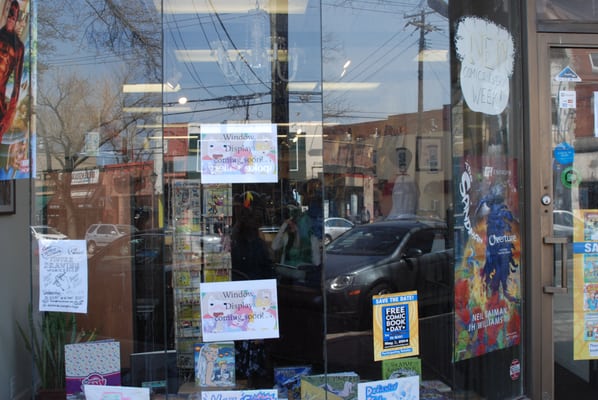
Identify the location of potted plant. The image size is (598, 400). (51, 347).